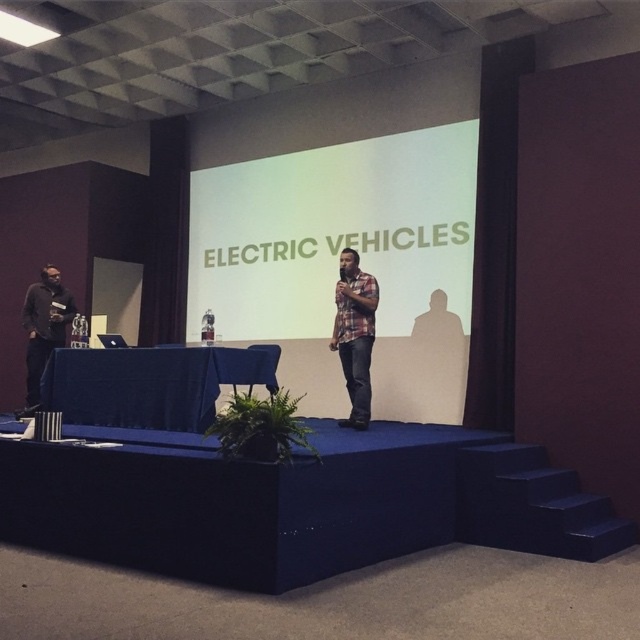
You are an event organizer who needs to arrange seating for the audience. The seats are arranged in rows facing the stage. You notice the plaid shirt at center and the matte black shirt at left on the stage. Which person should you position closer to the front of the stage to ensure all audience members can see them clearly?

The plaid shirt at center should be positioned closer to the front of the stage because they have a greater height compared to the matte black shirt at left, which may obstruct the view if they are too far forward.

You are a photographer in the audience of this presentation. You want to take a photo of the plaid shirt at center. What coordinates should you aim your camera at?

You should aim your camera at coordinates point (355, 333) to capture the plaid shirt at center.

You are an attendee sitting in the front row of the conference hall. You want to take a photo of the plaid shirt at center and the white matte projection screen at center. Which object will appear larger in your camera view?

The white matte projection screen at center is further to the viewer than plaid shirt at center, so it will appear larger in the camera view.